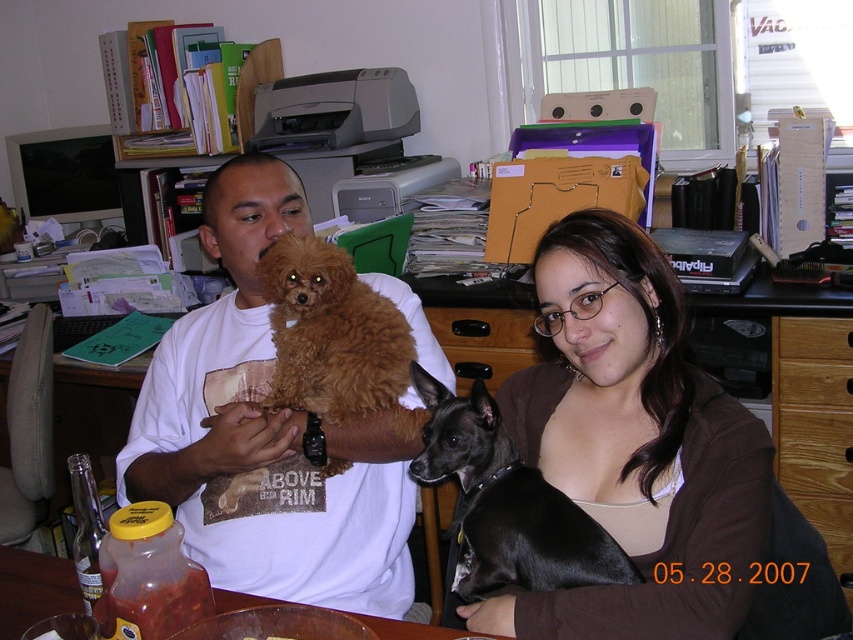
You are an AI analyzing the image. The scene shows two people at a desk with a brown dog and a black dog. Where is the matte brown hair at upper center located in the image coordinates?

The matte brown hair at upper center is located at coordinates point (631, 445).

You are trying to locate the matte brown hair at upper center in the image. According to the coordinates provided, where exactly is it positioned?

The matte brown hair at upper center is located at point coordinates of (631,445).